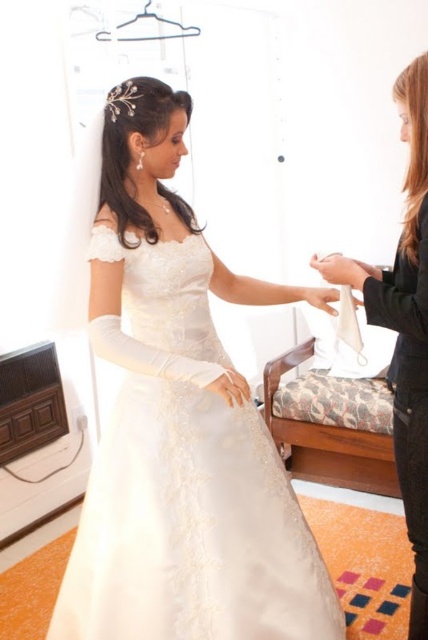
Question: Which point is farther from the camera taking this photo?

Choices:
 (A) (404, 355)
 (B) (202, 504)

Answer: (B)

Question: Where is satin dress at center located in relation to silky black dress at center in the image?

Choices:
 (A) left
 (B) right

Answer: (A)

Question: Which point is closer to the camera?

Choices:
 (A) satin dress at center
 (B) silky black dress at center

Answer: (B)

Question: Can you confirm if satin dress at center is bigger than silky black dress at center?

Choices:
 (A) no
 (B) yes

Answer: (B)

Question: Does satin dress at center have a greater width compared to silky black dress at center?

Choices:
 (A) yes
 (B) no

Answer: (A)

Question: Which of the following is the farthest from the observer?

Choices:
 (A) (401, 468)
 (B) (124, 484)

Answer: (A)